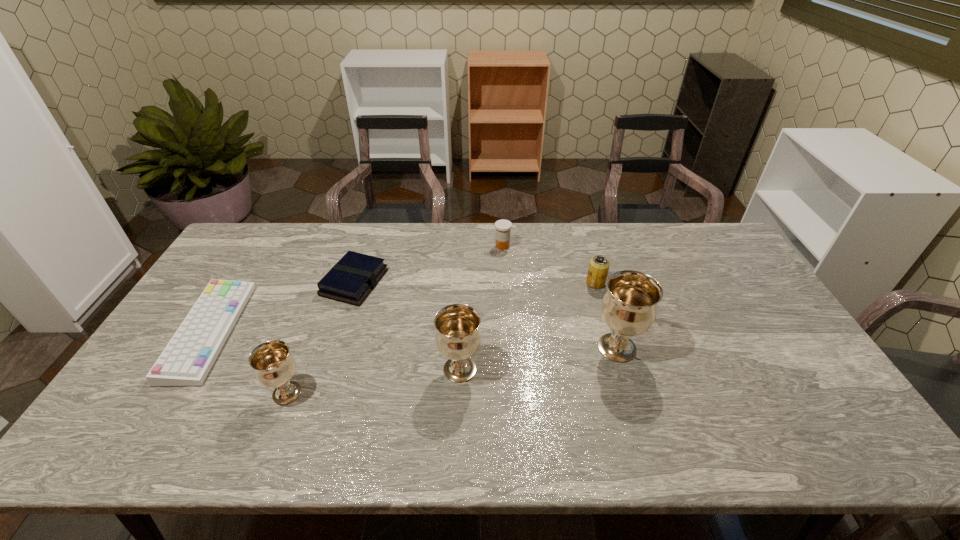
The image size is (960, 540). I want to click on the leftmost chalice, so pos(273,365).

This screenshot has width=960, height=540. I want to click on the shortest chalice, so click(273, 365).

Find the location of a particular element. the fourth object from right to left is located at coordinates (458, 337).

Where is `the second tallest chalice`? the second tallest chalice is located at coordinates [x=458, y=337].

Identify the location of the rightmost chalice. (629, 307).

Identify the location of the tallest chalice. The image size is (960, 540). (629, 307).

Where is `book`? The height and width of the screenshot is (540, 960). book is located at coordinates (351, 280).

At what (x,y) coordinates should I click in order to perform the action: click on medicine. Please return your answer as a coordinate pair (x, y). This screenshot has width=960, height=540. Looking at the image, I should click on (503, 227).

Locate an element on the screen. This screenshot has height=540, width=960. the farthest object is located at coordinates (503, 227).

You are a GUI agent. You are given a task and a screenshot of the screen. Output one action in this format:
    pyautogui.click(x=<x>, y=<y>)
    Task: Click on the beer can
    This screenshot has width=960, height=540.
    Given the screenshot: What is the action you would take?
    pyautogui.click(x=599, y=265)